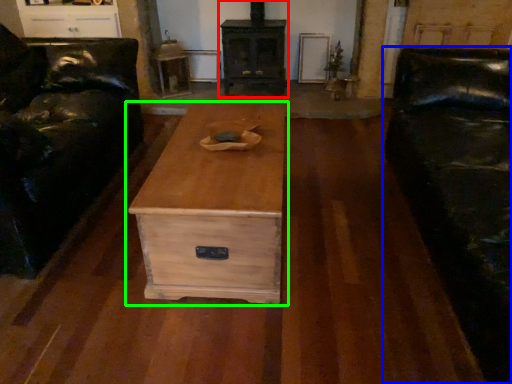
Question: Estimate the real-world distances between objects in this image. Which object is closer to fireplace (highlighted by a red box), studio couch (highlighted by a blue box) or chest of drawers (highlighted by a green box)?

Choices:
 (A) studio couch
 (B) chest of drawers

Answer: (A)